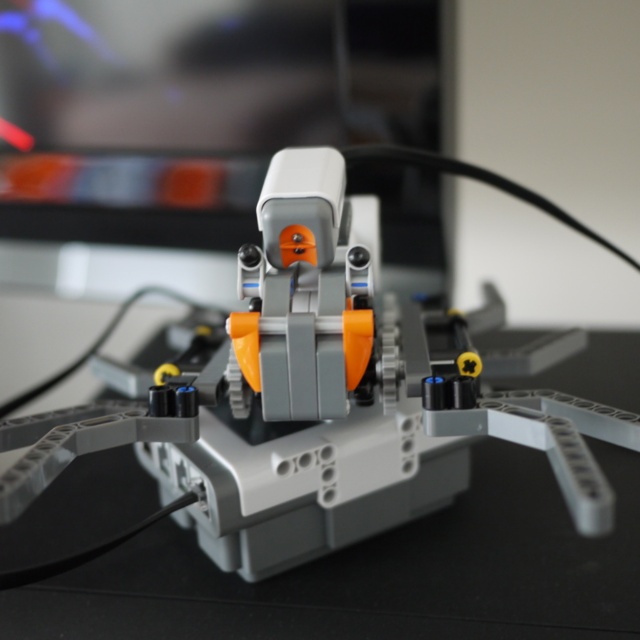
Is point (496, 397) positioned behind point (52, 97)?

No.

The image size is (640, 640). Describe the element at coordinates (321, 392) in the screenshot. I see `matte plastic robot at center` at that location.

Identify the location of matte plastic robot at center. This screenshot has height=640, width=640. (321, 392).